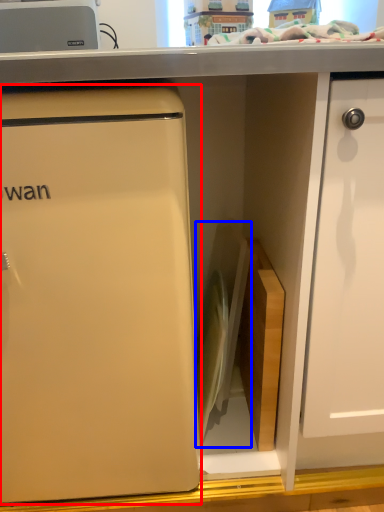
Question: Which point is closer to the camera, refrigerator (highlighted by a red box) or appliance (highlighted by a blue box)?

Choices:
 (A) refrigerator
 (B) appliance

Answer: (A)